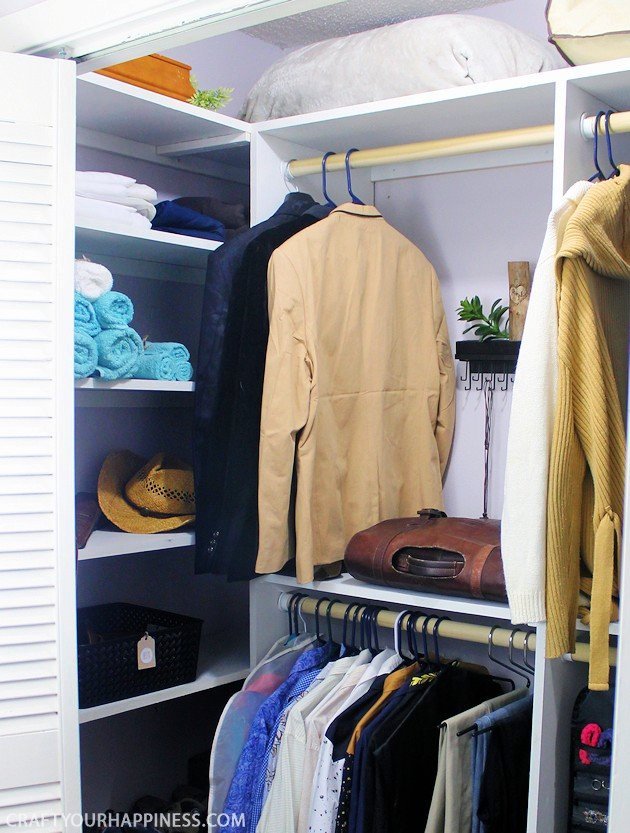
You are a GUI agent. You are given a task and a screenshot of the screen. Output one action in this format:
    pyautogui.click(x=<x>, y=<y>)
    Task: Click on the rolled blue towels
    This screenshot has width=630, height=833.
    Given the screenshot: What is the action you would take?
    pyautogui.click(x=81, y=352), pyautogui.click(x=86, y=318), pyautogui.click(x=118, y=310), pyautogui.click(x=116, y=350)